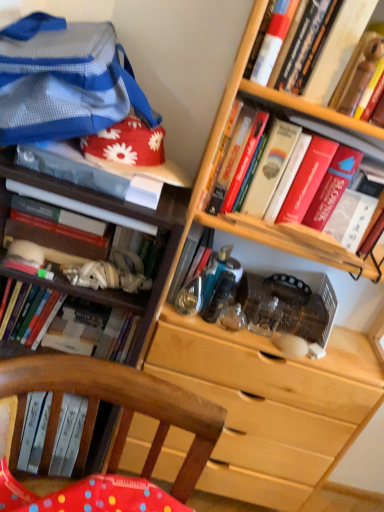
Find the location of a particular element. The width and height of the screenshot is (384, 512). vacant space situated above hardcover book at upper right, the 3th book in the right-to-left sequence (from a real-world perspective) is located at coordinates (318, 125).